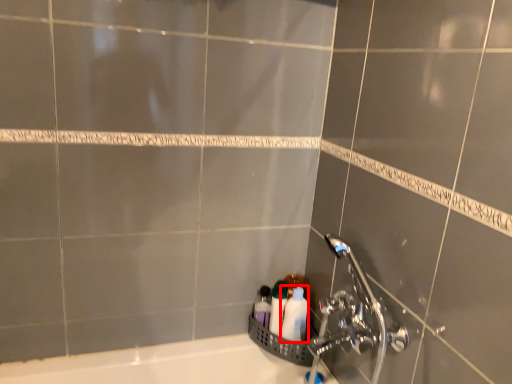
Question: From the image, what is the correct spatial relationship of toiletry (annotated by the red box) in relation to toiletry?

Choices:
 (A) left
 (B) right

Answer: (B)